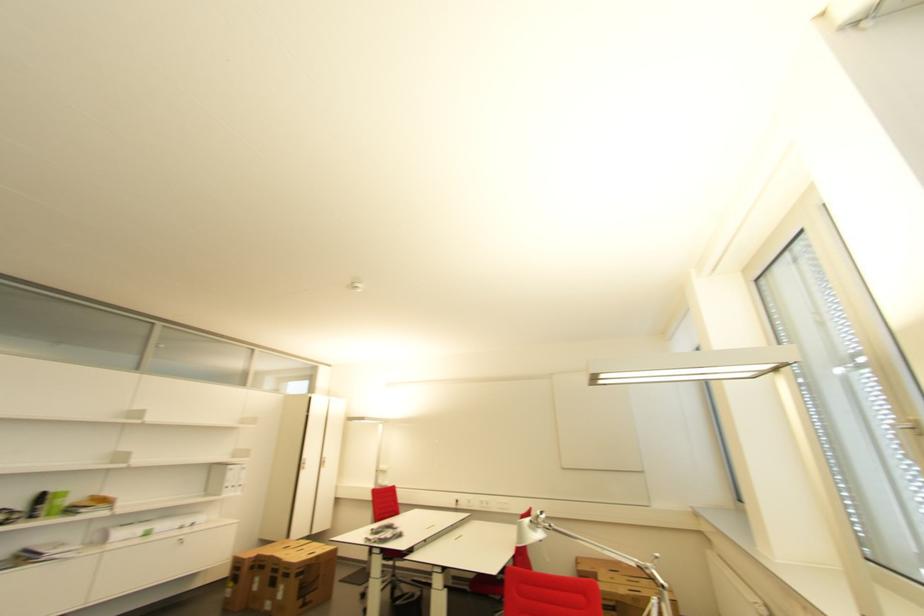
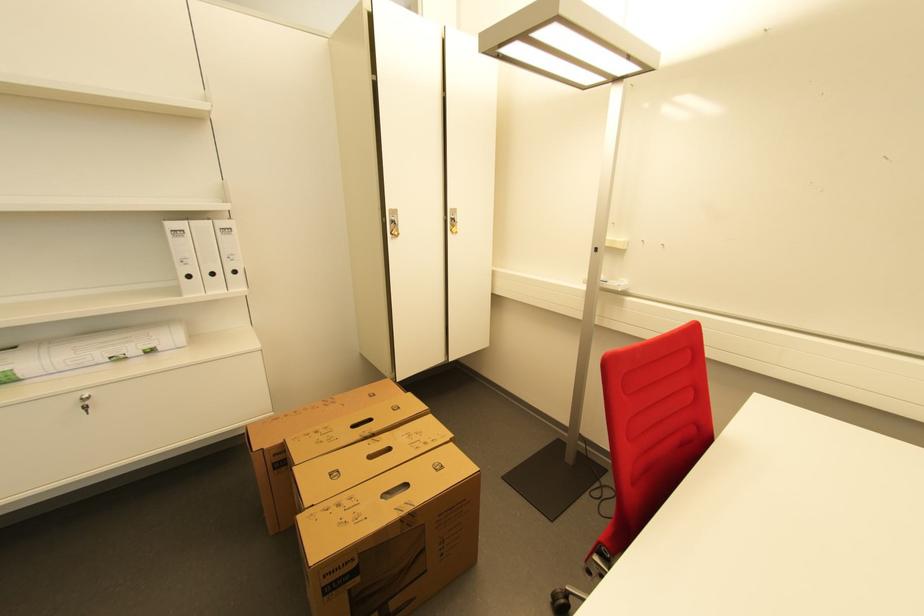
The point at (327, 464) is marked in the first image. Where is the corresponding point in the second image?

(455, 223)